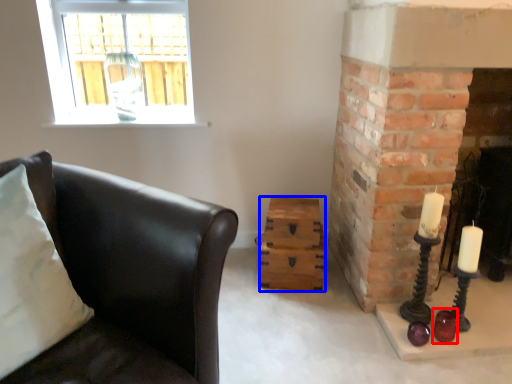
Question: Which object is further to the camera taking this photo, candle holder (highlighted by a red box) or drawer (highlighted by a blue box)?

Choices:
 (A) candle holder
 (B) drawer

Answer: (B)